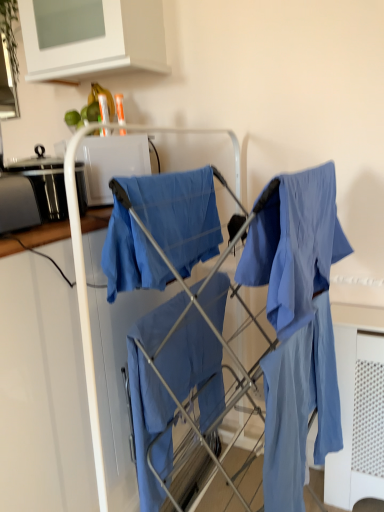
Question: Is blue cotton cloth at center, placed as the 2th cloak when sorted from bottom to top, thinner than matte blue fabric at center, which is the 2th cloak from top to bottom?

Choices:
 (A) yes
 (B) no

Answer: (B)

Question: Is matte blue fabric at center, which is the 2th cloak from top to bottom, at the back of blue cotton cloth at center, placed as the first cloak when sorted from top to bottom?

Choices:
 (A) yes
 (B) no

Answer: (B)

Question: Does blue cotton cloth at center, placed as the first cloak when sorted from top to bottom, come behind matte blue fabric at center, which is the 2th cloak from top to bottom?

Choices:
 (A) yes
 (B) no

Answer: (B)

Question: Is blue cotton cloth at center, placed as the 2th cloak when sorted from bottom to top, outside matte blue fabric at center, which is the 2th cloak from top to bottom?

Choices:
 (A) yes
 (B) no

Answer: (A)

Question: From a real-world perspective, is blue cotton cloth at center, placed as the first cloak when sorted from top to bottom, located higher than matte blue fabric at center, which appears as the first cloak when ordered from the bottom?

Choices:
 (A) no
 (B) yes

Answer: (B)

Question: Does blue cotton cloth at center, placed as the first cloak when sorted from top to bottom, appear on the left side of matte blue fabric at center, which is the 2th cloak from top to bottom?

Choices:
 (A) no
 (B) yes

Answer: (B)

Question: Is white glossy microwave at upper center turned away from white matte cabinet at upper center?

Choices:
 (A) yes
 (B) no

Answer: (B)

Question: From the image's perspective, is white glossy microwave at upper center on top of white matte cabinet at upper center?

Choices:
 (A) no
 (B) yes

Answer: (A)

Question: Can we say white glossy microwave at upper center lies outside white matte cabinet at upper center?

Choices:
 (A) no
 (B) yes

Answer: (B)

Question: Is white glossy microwave at upper center further to camera compared to white matte cabinet at upper center?

Choices:
 (A) yes
 (B) no

Answer: (A)

Question: From the image's perspective, is white glossy microwave at upper center located beneath white matte cabinet at upper center?

Choices:
 (A) no
 (B) yes

Answer: (B)

Question: From a real-world perspective, is white glossy microwave at upper center physically above white matte cabinet at upper center?

Choices:
 (A) yes
 (B) no

Answer: (B)

Question: Does white matte cabinet at upper center have a greater height compared to matte blue fabric at center, which appears as the first cloak when ordered from the bottom?

Choices:
 (A) no
 (B) yes

Answer: (A)